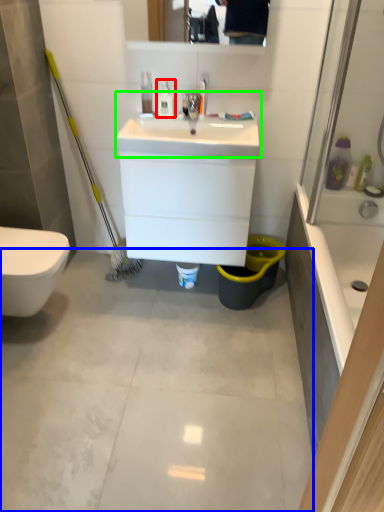
Question: Which object is positioned closest to toiletry (highlighted by a red box)? Select from concrete (highlighted by a blue box) and sink (highlighted by a green box).

Choices:
 (A) concrete
 (B) sink

Answer: (B)